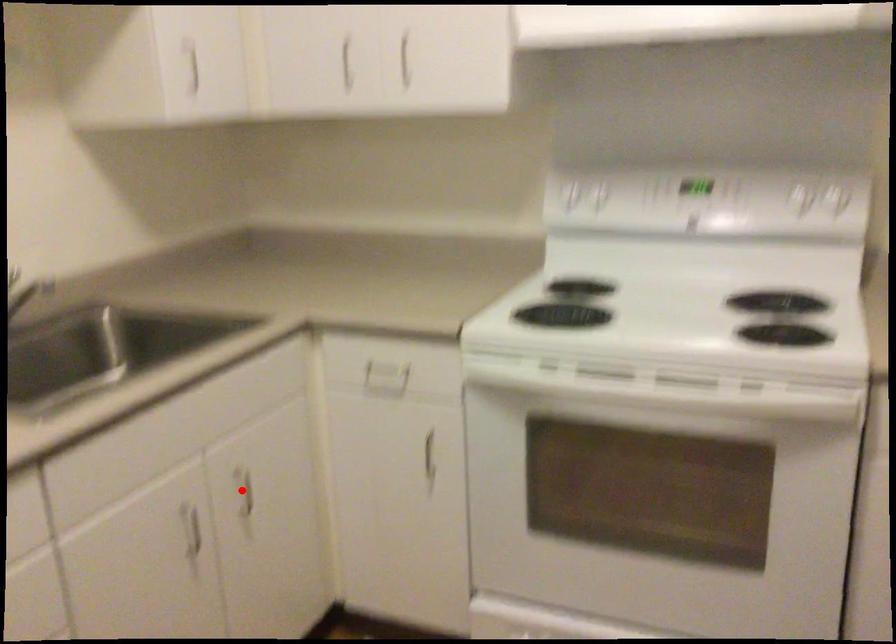
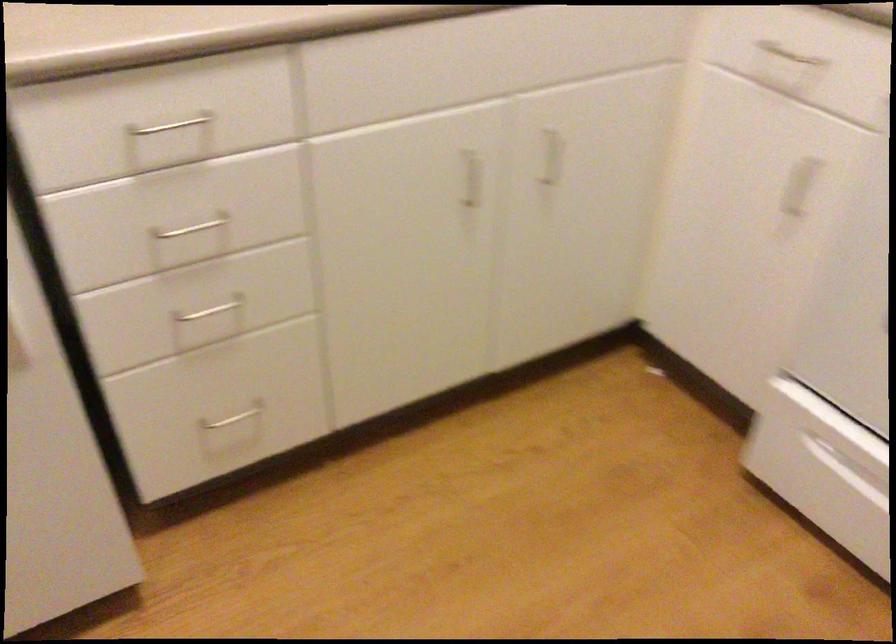
Question: A red point is marked in image1. In image2, is the corresponding 3D point closer to the camera or farther? Reply with the corresponding letter.

Choices:
 (A) The corresponding 3D point is closer.
 (B) The corresponding 3D point is farther.

Answer: (A)